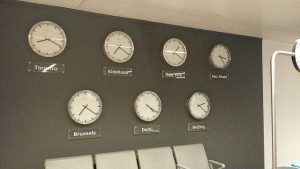
At what (x,y) coordinates should I click in order to perform the action: click on clock. Please return your answer as a coordinate pair (x, y). This screenshot has width=300, height=169. Looking at the image, I should click on [x=45, y=30].